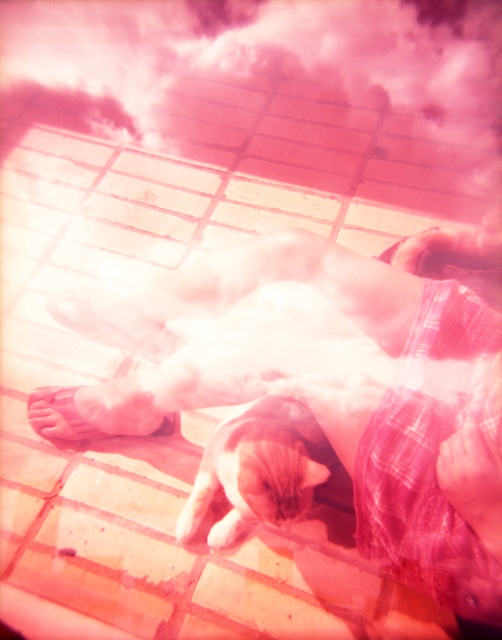
Question: Among these objects, which one is nearest to the camera?

Choices:
 (A) soft fur cat at center
 (B) fuzzy pink cloud at upper center

Answer: (A)

Question: Can you confirm if soft fur cat at center is wider than pink matte sandal at lower left?

Choices:
 (A) no
 (B) yes

Answer: (A)

Question: Does fuzzy pink cloud at upper center appear under soft fur cat at center?

Choices:
 (A) yes
 (B) no

Answer: (B)

Question: Which point is farther from the camera taking this photo?

Choices:
 (A) (131, 426)
 (B) (236, 465)

Answer: (A)

Question: Can you confirm if tabby fur cat at center is positioned above fuzzy pink cloud at upper center?

Choices:
 (A) yes
 (B) no

Answer: (B)

Question: Estimate the real-world distances between objects in this image. Which object is farther from the smooth pink foot at center?

Choices:
 (A) pink matte sandal at lower left
 (B) soft fur cat at center
 (C) fuzzy pink cloud at upper center

Answer: (C)